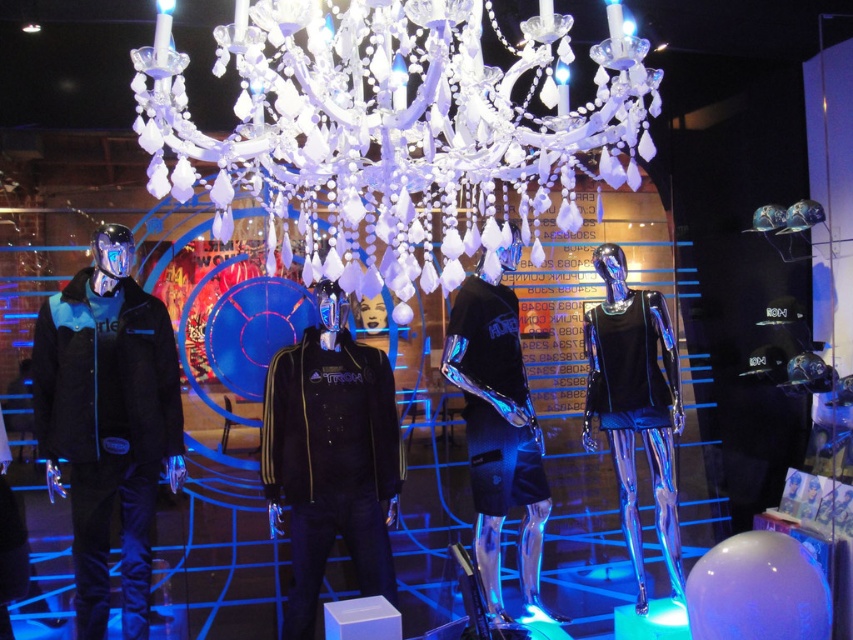
Which of these two, matte black jacket at left or black matte jacket at center, stands shorter?

Standing shorter between the two is black matte jacket at center.

Is matte black jacket at left bigger than black matte jacket at center?

Yes.

Image resolution: width=853 pixels, height=640 pixels. Describe the element at coordinates (108, 422) in the screenshot. I see `matte black jacket at left` at that location.

I want to click on matte black jacket at left, so click(x=108, y=422).

Does crystal glass chandelier at upper center have a lesser width compared to glossy black shorts at center?

No, crystal glass chandelier at upper center is not thinner than glossy black shorts at center.

Looking at this image, which of these two, crystal glass chandelier at upper center or glossy black shorts at center, stands shorter?

crystal glass chandelier at upper center

The image size is (853, 640). What do you see at coordinates (393, 128) in the screenshot?
I see `crystal glass chandelier at upper center` at bounding box center [393, 128].

Identify the location of crystal glass chandelier at upper center. (393, 128).

Between black matte jacket at center and shiny black tank top at center, which one appears on the left side from the viewer's perspective?

Positioned to the left is black matte jacket at center.

Does point (393, 586) lie behind point (616, 461)?

No, (393, 586) is closer to viewer.

The width and height of the screenshot is (853, 640). Describe the element at coordinates (331, 458) in the screenshot. I see `black matte jacket at center` at that location.

The width and height of the screenshot is (853, 640). What are the coordinates of `black matte jacket at center` in the screenshot? It's located at (331, 458).